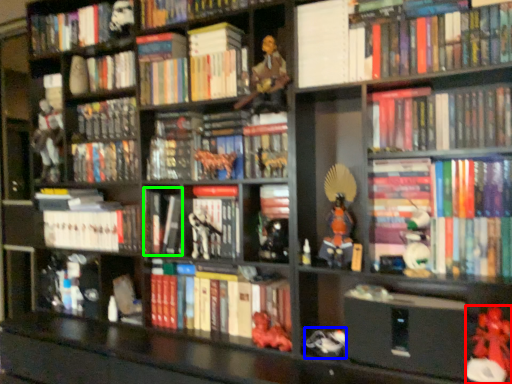
Question: Which object is positioned closest to toy (highlighted by a red box)? Select from toy (highlighted by a blue box) and book (highlighted by a green box).

Choices:
 (A) toy
 (B) book

Answer: (A)